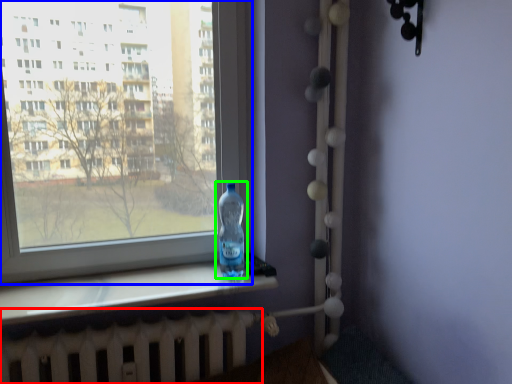
Question: Considering the real-world distances, which object is closest to radiator (highlighted by a red box)? window (highlighted by a blue box) or bottle (highlighted by a green box).

Choices:
 (A) window
 (B) bottle

Answer: (A)